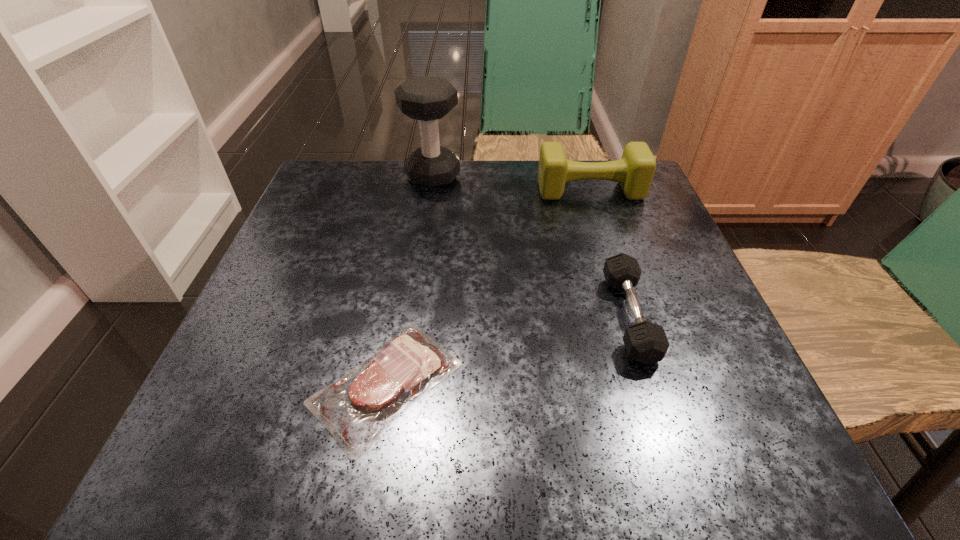
Locate an element on the screen. The width and height of the screenshot is (960, 540). object at the near edge is located at coordinates (356, 408).

Locate an element on the screen. This screenshot has height=540, width=960. object positioned at the left edge is located at coordinates (356, 408).

Where is `object that is positioned at the near left corner`? The image size is (960, 540). object that is positioned at the near left corner is located at coordinates (356, 408).

Identify the location of object at the far right corner. (634, 171).

Image resolution: width=960 pixels, height=540 pixels. I want to click on vacant point at the far edge, so click(x=557, y=203).

Find the location of a particular element. vacant space at the near edge of the desktop is located at coordinates (655, 463).

Locate an element on the screen. free location at the left edge of the desktop is located at coordinates (283, 318).

Image resolution: width=960 pixels, height=540 pixels. What are the coordinates of `vacant space at the right edge` in the screenshot? It's located at (732, 386).

This screenshot has height=540, width=960. In order to click on blank space at the far left corner in this screenshot , I will do `click(347, 172)`.

This screenshot has width=960, height=540. What are the coordinates of `free spot at the far right corner of the desktop` in the screenshot? It's located at (625, 215).